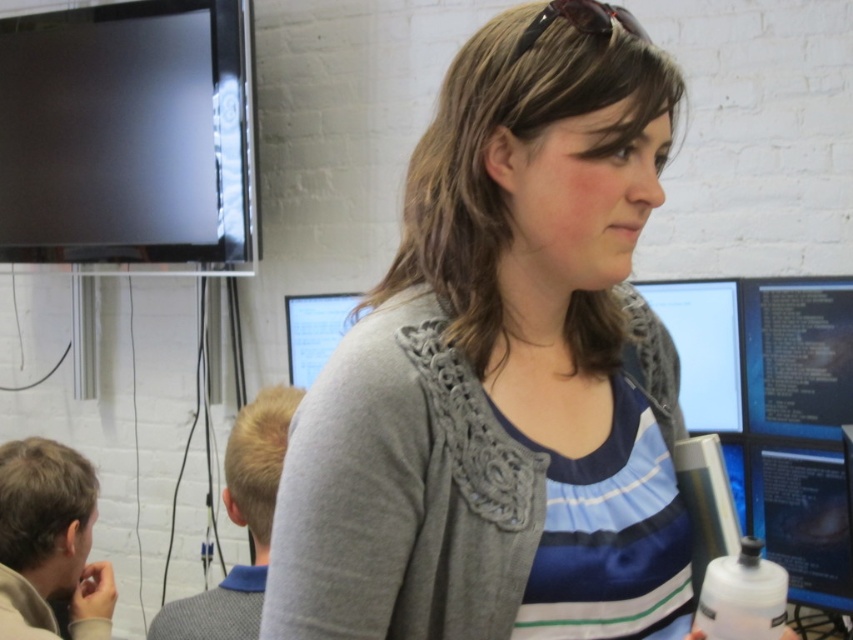
Question: Is matte plastic monitor at center to the right of matte plastic computer monitor at right from the viewer's perspective?

Choices:
 (A) yes
 (B) no

Answer: (A)

Question: Which point appears farthest from the camera in this image?

Choices:
 (A) (814, 563)
 (B) (717, 628)

Answer: (A)

Question: Can you confirm if matte black monitor at right is positioned to the right of matte plastic computer monitor at right?

Choices:
 (A) yes
 (B) no

Answer: (A)

Question: Does gray knitted cardigan at center have a lesser width compared to black glossy code at right?

Choices:
 (A) yes
 (B) no

Answer: (B)

Question: Among these points, which one is nearest to the camera?

Choices:
 (A) (706, 372)
 (B) (732, 506)
 (C) (815, 424)

Answer: (B)

Question: Which point is closer to the camera taking this photo?

Choices:
 (A) (751, 388)
 (B) (486, 515)

Answer: (B)